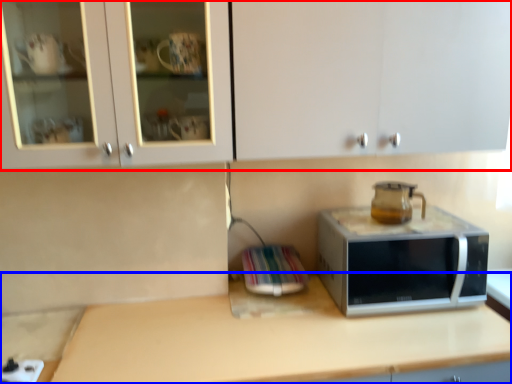
Question: Which point is closer to the camera, cabinetry (highlighted by a red box) or countertop (highlighted by a blue box)?

Choices:
 (A) cabinetry
 (B) countertop

Answer: (A)